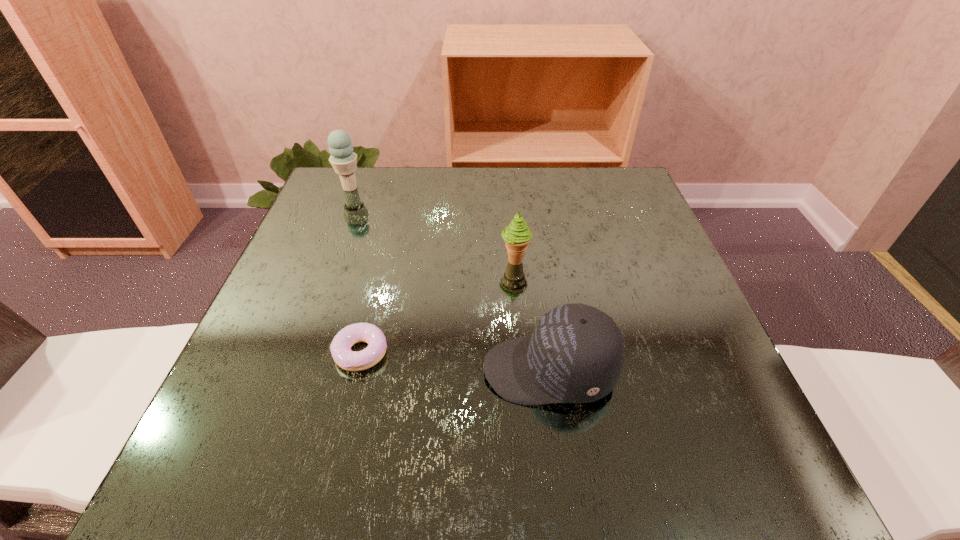
I want to click on vacant space located at the front of the baseball cap where the brim is located, so click(347, 370).

The width and height of the screenshot is (960, 540). I want to click on vacant region located 0.260m at the front of the baseball cap where the brim is located, so click(328, 370).

The width and height of the screenshot is (960, 540). Find the location of `vacant position located on the back of the shortest object`. vacant position located on the back of the shortest object is located at coordinates (386, 248).

What are the coordinates of `object that is at the far edge` in the screenshot? It's located at (343, 159).

Find the location of `ice cream situated at the left edge`. ice cream situated at the left edge is located at coordinates [343, 159].

The width and height of the screenshot is (960, 540). What are the coordinates of `doughnut that is at the left edge` in the screenshot? It's located at (344, 357).

This screenshot has width=960, height=540. I want to click on object at the far left corner, so click(343, 159).

In the image, there is a desktop. At what (x,y) coordinates should I click in order to perform the action: click on blank space at the far edge. Please return your answer as a coordinate pair (x, y). The image size is (960, 540). Looking at the image, I should click on (498, 171).

At what (x,y) coordinates should I click in order to perform the action: click on free region at the near edge of the desktop. Please return your answer as a coordinate pair (x, y). The height and width of the screenshot is (540, 960). Looking at the image, I should click on (453, 472).

In the image, there is a desktop. Where is `vacant space at the left edge`? Image resolution: width=960 pixels, height=540 pixels. vacant space at the left edge is located at coordinates (341, 233).